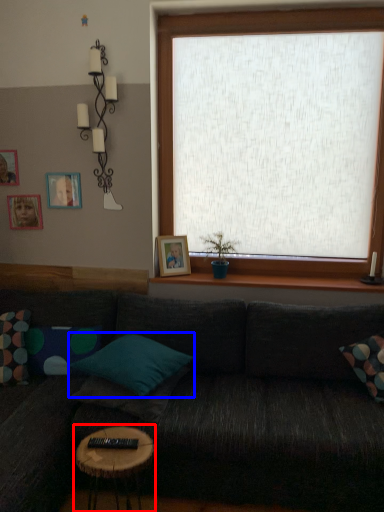
Question: Which of the following is the farthest to the observer, table (highlighted by a red box) or pillow (highlighted by a blue box)?

Choices:
 (A) table
 (B) pillow

Answer: (B)